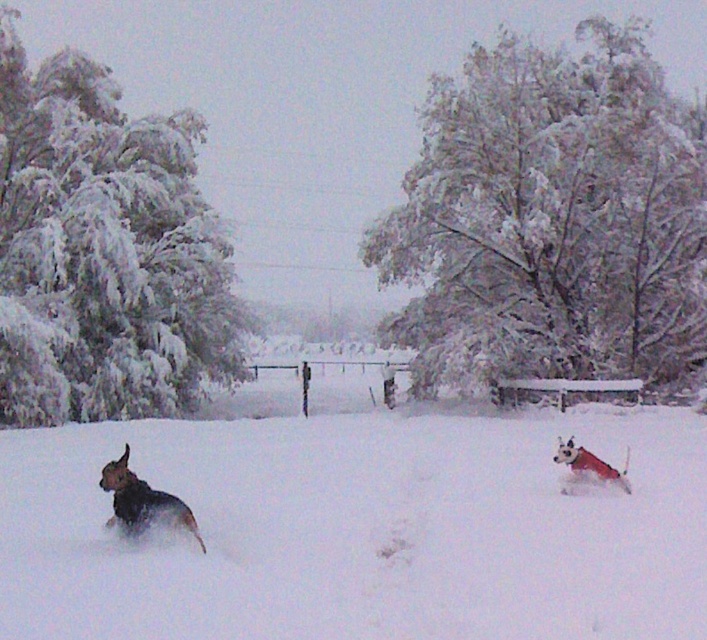
Question: Does white fluffy snow at center appear over snow-covered tree at upper center?

Choices:
 (A) no
 (B) yes

Answer: (A)

Question: Which point is farther from the camera taking this photo?

Choices:
 (A) (165, 502)
 (B) (93, 344)

Answer: (B)

Question: Does white frosty tree at left have a lesser width compared to white fur dog at lower right?

Choices:
 (A) no
 (B) yes

Answer: (A)

Question: Considering the real-world distances, which object is closest to the snow-covered tree at upper center?

Choices:
 (A) white frosty tree at left
 (B) white fur dog at lower right
 (C) white fluffy snow at center
 (D) brown fur dog at lower left

Answer: (A)

Question: Can you confirm if snow-covered tree at upper center is thinner than white fur dog at lower right?

Choices:
 (A) no
 (B) yes

Answer: (A)

Question: Among these objects, which one is nearest to the camera?

Choices:
 (A) brown fur dog at lower left
 (B) snow-covered tree at upper center

Answer: (A)